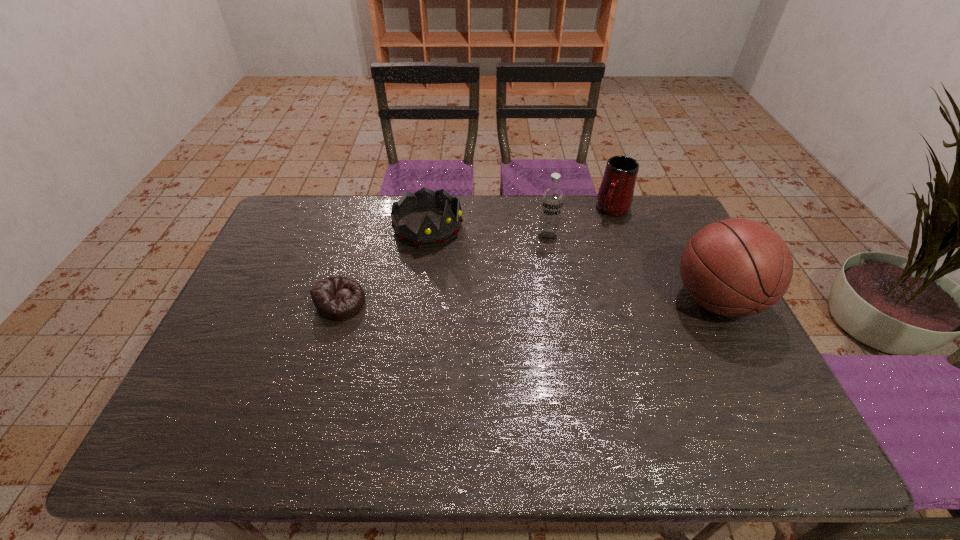
I want to click on free space located at the front of the tiara with jewels, so click(x=541, y=308).

At what (x,y) coordinates should I click in order to perform the action: click on vacant space located 0.130m on the front label of the third object from left to right. Please return your answer as a coordinate pair (x, y). Image resolution: width=960 pixels, height=540 pixels. Looking at the image, I should click on (533, 271).

I want to click on free spot located 0.350m on the front label of the third object from left to right, so click(x=510, y=323).

This screenshot has height=540, width=960. I want to click on free region located on the front label of the third object from left to right, so click(x=522, y=295).

Identify the location of free space located on the side of the mug with the handle. (576, 272).

Locate an element on the screen. vacant space located 0.160m on the side of the mug with the handle is located at coordinates (591, 247).

What are the coordinates of `free space located on the side of the mug with the handle` in the screenshot? It's located at (567, 286).

The height and width of the screenshot is (540, 960). What are the coordinates of `tiara that is at the far edge` in the screenshot? It's located at (428, 235).

In order to click on vodka located in the far edge section of the desktop in this screenshot , I will do `click(552, 199)`.

In order to click on mug present at the far edge in this screenshot , I will do `click(615, 195)`.